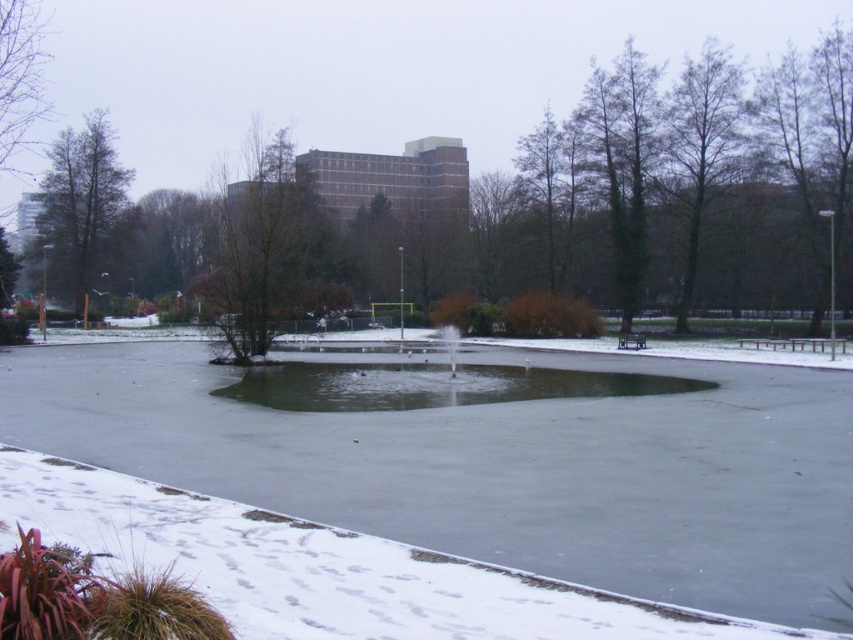
Question: Which point is closer to the camera taking this photo?

Choices:
 (A) (108, 148)
 (B) (706, 120)
 (C) (264, 310)

Answer: (C)

Question: Considering the relative positions of bare branches at upper right and green matte tree at left in the image provided, where is bare branches at upper right located with respect to green matte tree at left?

Choices:
 (A) left
 (B) right

Answer: (B)

Question: Does green matte tree at center appear on the left side of green matte tree at left?

Choices:
 (A) no
 (B) yes

Answer: (A)

Question: Which point is closer to the camera?

Choices:
 (A) (717, 189)
 (B) (306, 304)

Answer: (B)

Question: Is bare branches at upper right thinner than green matte tree at left?

Choices:
 (A) yes
 (B) no

Answer: (A)

Question: Which point is farther to the camera?

Choices:
 (A) tap(96, 161)
 (B) tap(671, 156)

Answer: (A)